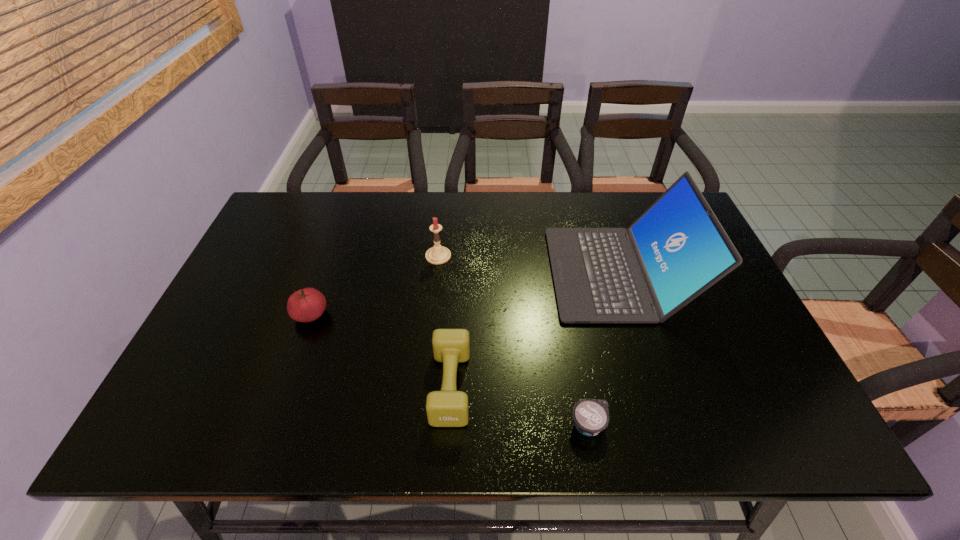
You are a GUI agent. You are given a task and a screenshot of the screen. Output one action in this format:
    pyautogui.click(x=<x>, y=<y>)
    Task: Click on the unoccupied position between the tallest object and the dumbbell
    The height and width of the screenshot is (540, 960).
    Given the screenshot: What is the action you would take?
    pyautogui.click(x=535, y=329)

Find the location of a particular element. Image resolution: width=960 pixels, height=540 pixels. free spot between the yogurt and the tallest object is located at coordinates (x=603, y=349).

Point out which object is positioned as the fourth nearest to the shortest object. Please provide its 2D coordinates. Your answer should be formatted as a tuple, i.e. [(x, y)], where the tuple contains the x and y coordinates of a point satisfying the conditions above.

[(306, 305)]

Identify which object is the fourth closest to the leftmost object. Please provide its 2D coordinates. Your answer should be formatted as a tuple, i.e. [(x, y)], where the tuple contains the x and y coordinates of a point satisfying the conditions above.

[(591, 416)]

Find the location of a particular element. vacant space that satisfies the following two spatial constraints: 1. on the back side of the second tallest object; 2. on the right side of the leftmost object is located at coordinates (331, 256).

Find the location of `vacant area that satisfies the following two spatial constraints: 1. on the front side of the yogurt; 2. on the left side of the second tallest object`. vacant area that satisfies the following two spatial constraints: 1. on the front side of the yogurt; 2. on the left side of the second tallest object is located at coordinates (421, 425).

Locate an element on the screen. free space in the image that satisfies the following two spatial constraints: 1. on the screen of the tallest object; 2. on the front side of the tomato is located at coordinates (632, 315).